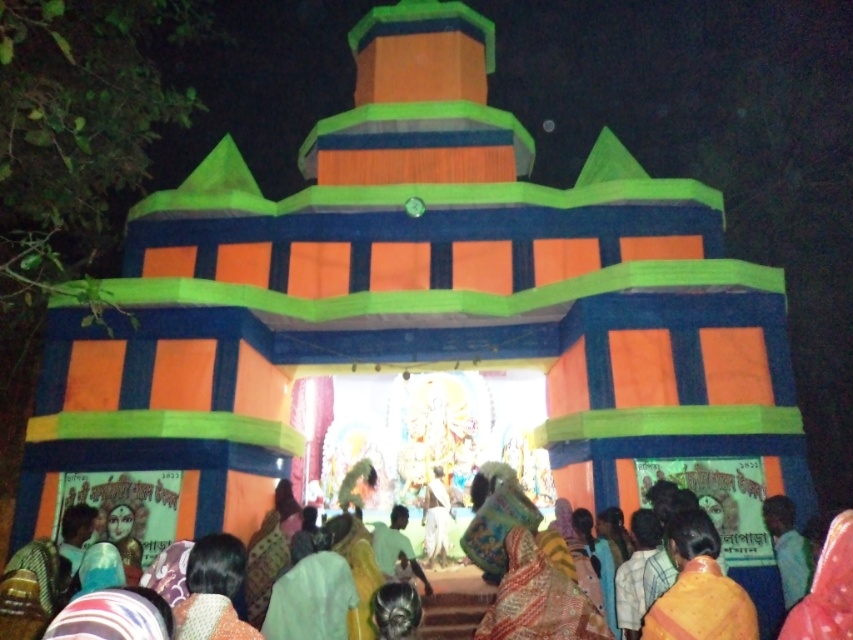
Question: Does multicolored fabric at center have a greater width compared to yellow fabric robe at center?

Choices:
 (A) yes
 (B) no

Answer: (A)

Question: Is the position of multicolored fabric at center less distant than that of yellow fabric robe at center?

Choices:
 (A) no
 (B) yes

Answer: (B)

Question: Which of the following is the farthest from the observer?

Choices:
 (A) (715, 566)
 (B) (538, 618)

Answer: (B)

Question: Considering the real-world distances, which object is farthest from the multicolored fabric at center?

Choices:
 (A) yellow fabric robe at center
 (B) multicolored fabric robe at lower center

Answer: (A)

Question: Does multicolored fabric at center appear on the right side of multicolored fabric robe at lower center?

Choices:
 (A) no
 (B) yes

Answer: (A)

Question: Which of the following is the closest to the observer?

Choices:
 (A) (692, 584)
 (B) (496, 552)
 (C) (561, 573)

Answer: (A)